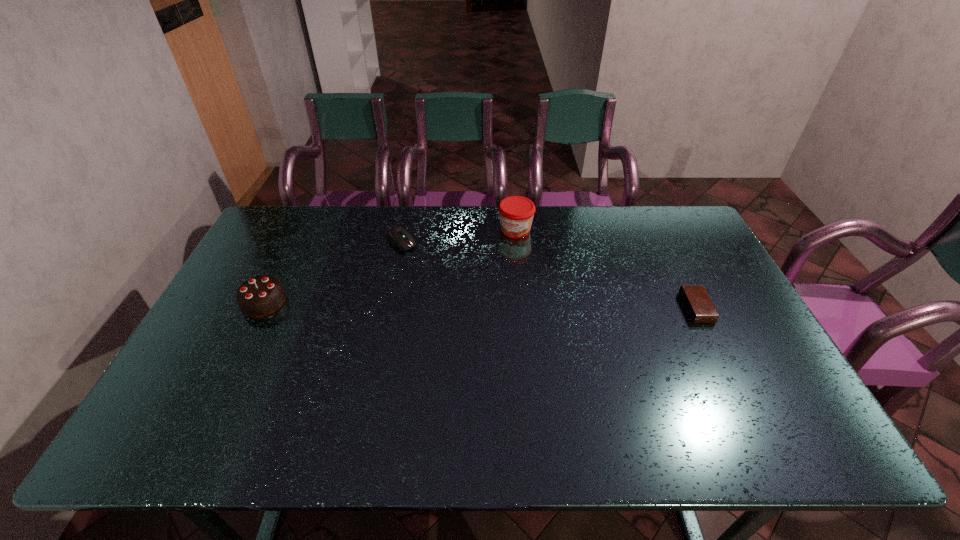
The height and width of the screenshot is (540, 960). What are the coordinates of `vacant area that lies between the second object from left to right and the third object from left to right` in the screenshot? It's located at (458, 236).

The height and width of the screenshot is (540, 960). I want to click on free space between the third object from left to right and the computer equipment, so click(458, 236).

Find the location of a particular element. free space between the chocolate cake and the jam is located at coordinates (390, 266).

Find the location of a particular element. vacant area that lies between the computer equipment and the jam is located at coordinates (458, 236).

Where is `free area in between the second object from right to left and the chocolate cake`? The width and height of the screenshot is (960, 540). free area in between the second object from right to left and the chocolate cake is located at coordinates (390, 266).

Identify which object is the third closest to the second object from right to left. Please provide its 2D coordinates. Your answer should be formatted as a tuple, i.e. [(x, y)], where the tuple contains the x and y coordinates of a point satisfying the conditions above.

[(260, 296)]

I want to click on object that ranks as the second closest to the rightmost object, so click(398, 236).

Where is `vacant space that satisfies the following two spatial constraints: 1. on the front side of the chocolate cake; 2. on the front face of the alarm clock`? The height and width of the screenshot is (540, 960). vacant space that satisfies the following two spatial constraints: 1. on the front side of the chocolate cake; 2. on the front face of the alarm clock is located at coordinates (261, 307).

The height and width of the screenshot is (540, 960). I want to click on vacant area that satisfies the following two spatial constraints: 1. on the front side of the rightmost object; 2. on the front face of the second object from left to right, so click(x=387, y=307).

Find the location of a particular element. The image size is (960, 540). free location that satisfies the following two spatial constraints: 1. on the front side of the third object from right to left; 2. on the front face of the alarm clock is located at coordinates (387, 307).